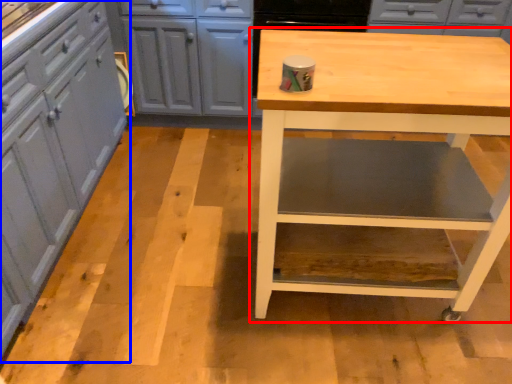
Question: Which of the following is the closest to the observer, table (highlighted by a red box) or cabinetry (highlighted by a blue box)?

Choices:
 (A) table
 (B) cabinetry

Answer: (B)